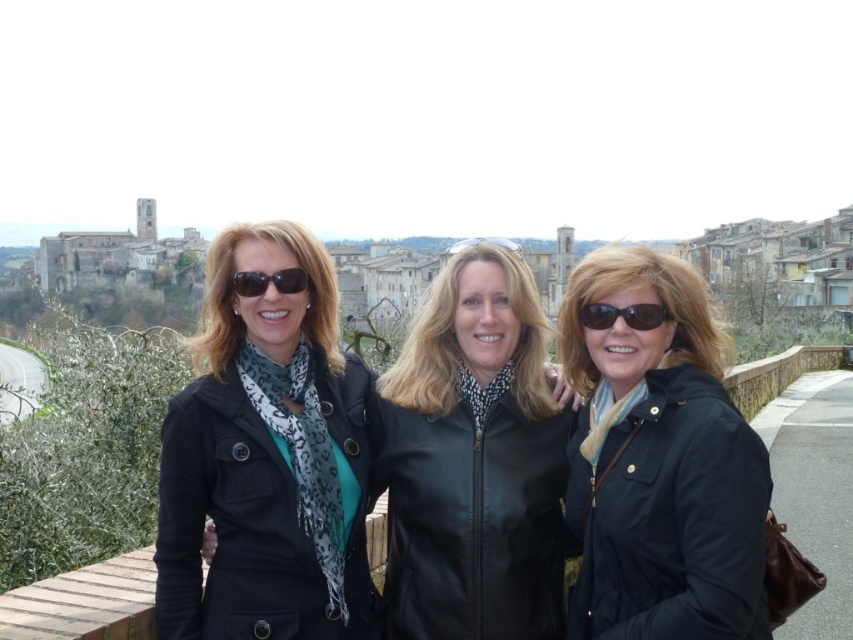
Question: Does matte black jacket at center appear on the right side of clear plastic goggles at center?

Choices:
 (A) no
 (B) yes

Answer: (B)

Question: Which point is farther from the camera taking this photo?

Choices:
 (A) (634, 246)
 (B) (523, 636)
 (C) (506, 244)
 (D) (283, 280)

Answer: (C)

Question: Which is farther from the matte black coat at center?

Choices:
 (A) black leather jacket at center
 (B) black plastic sunglasses at center
 (C) matte black sunglasses at center

Answer: (B)

Question: Is matte black coat at center to the right of clear plastic goggles at center from the viewer's perspective?

Choices:
 (A) yes
 (B) no

Answer: (B)

Question: Does matte black coat at center appear over black plastic sunglasses at center?

Choices:
 (A) yes
 (B) no

Answer: (B)

Question: Which of the following is the farthest from the observer?

Choices:
 (A) (587, 324)
 (B) (252, 269)
 (C) (511, 250)

Answer: (C)